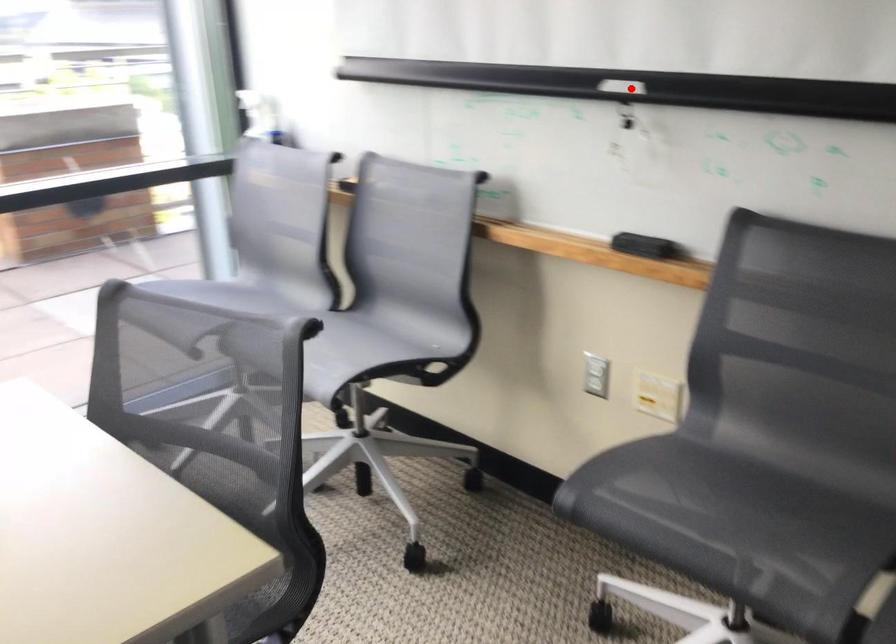
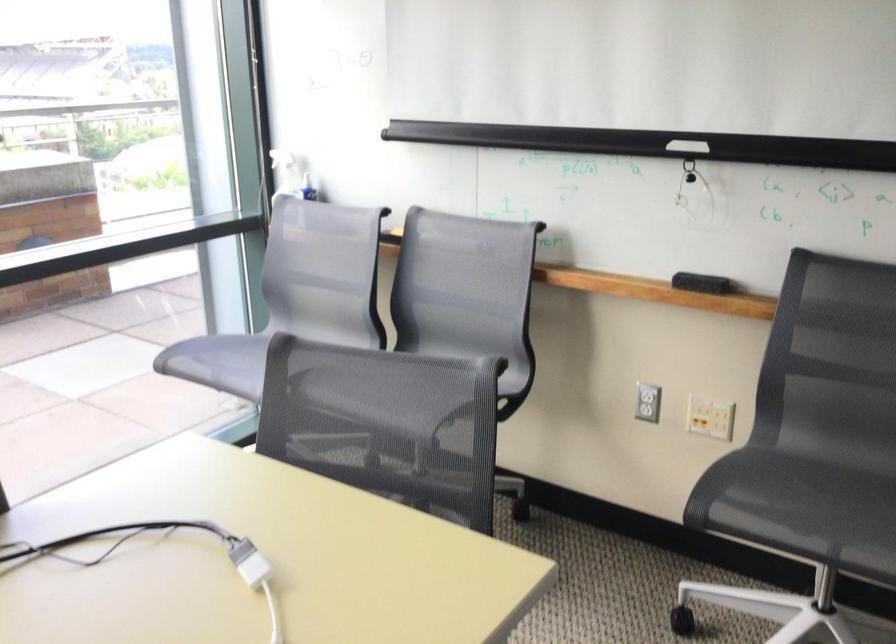
Locate, in the second image, the point that corresponds to the highlighted location in the first image.

(687, 146)